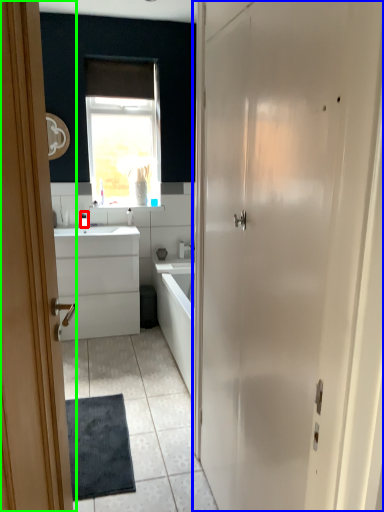
Question: Based on their relative distances, which object is nearer to toiletry (highlighted by a red box)? Choose from door (highlighted by a blue box) and door (highlighted by a green box).

Choices:
 (A) door
 (B) door

Answer: (B)